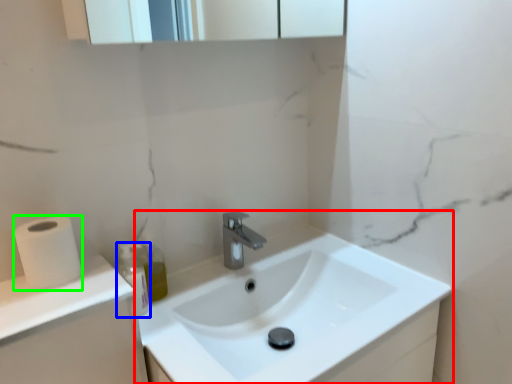
Question: Based on their relative distances, which object is nearer to sink (highlighted by a red box)? Choose from bottle (highlighted by a blue box) and toilet paper (highlighted by a green box).

Choices:
 (A) bottle
 (B) toilet paper

Answer: (A)